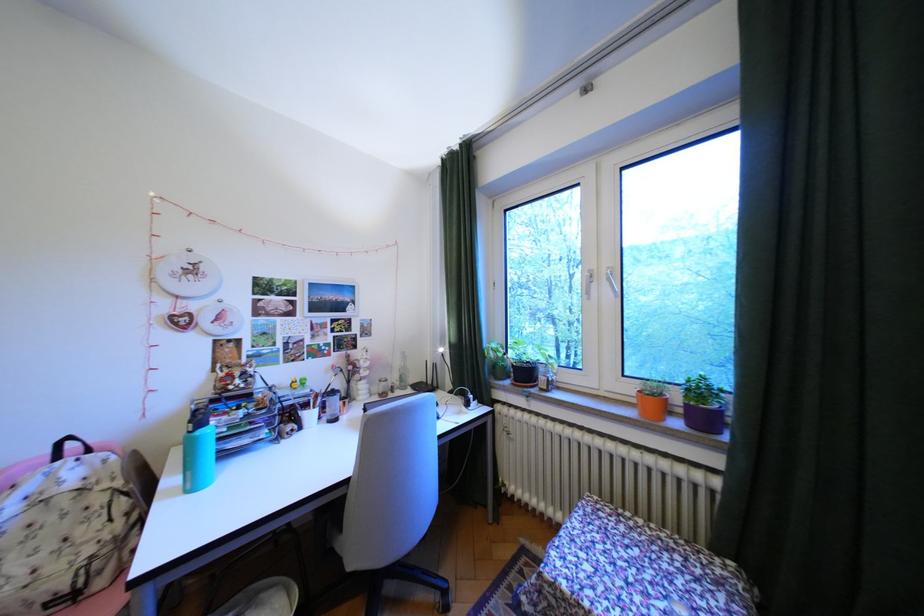
Identify the location of brown flower pot. (651, 400).